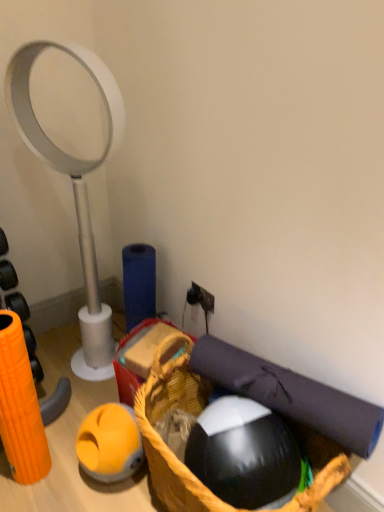
Question: Is dark blue fabric yoga mat at lower right to the right of black rubber ball at lower center from the viewer's perspective?

Choices:
 (A) no
 (B) yes

Answer: (B)

Question: Can black rubber ball at lower center be found inside dark blue fabric yoga mat at lower right?

Choices:
 (A) yes
 (B) no

Answer: (B)

Question: Is dark blue fabric yoga mat at lower right with black rubber ball at lower center?

Choices:
 (A) yes
 (B) no

Answer: (B)

Question: Does dark blue fabric yoga mat at lower right lie in front of black rubber ball at lower center?

Choices:
 (A) no
 (B) yes

Answer: (A)

Question: Does dark blue fabric yoga mat at lower right have a lesser height compared to black rubber ball at lower center?

Choices:
 (A) no
 (B) yes

Answer: (B)

Question: Is dark blue fabric yoga mat at lower right taller than black rubber ball at lower center?

Choices:
 (A) yes
 (B) no

Answer: (B)

Question: Is black rubber ball at lower center smaller than dark blue fabric yoga mat at lower right?

Choices:
 (A) no
 (B) yes

Answer: (B)

Question: Considering the relative sizes of black rubber ball at lower center and dark blue fabric yoga mat at lower right in the image provided, is black rubber ball at lower center shorter than dark blue fabric yoga mat at lower right?

Choices:
 (A) no
 (B) yes

Answer: (A)

Question: Can you confirm if black rubber ball at lower center is thinner than dark blue fabric yoga mat at lower right?

Choices:
 (A) yes
 (B) no

Answer: (B)

Question: Does black rubber ball at lower center have a greater width compared to dark blue fabric yoga mat at lower right?

Choices:
 (A) no
 (B) yes

Answer: (B)

Question: Would you consider black rubber ball at lower center to be distant from dark blue fabric yoga mat at lower right?

Choices:
 (A) yes
 (B) no

Answer: (B)

Question: From the image's perspective, is black rubber ball at lower center above dark blue fabric yoga mat at lower right?

Choices:
 (A) no
 (B) yes

Answer: (A)

Question: From a real-world perspective, is black rubber ball at lower center below white plastic magnifying glass at left?

Choices:
 (A) yes
 (B) no

Answer: (A)